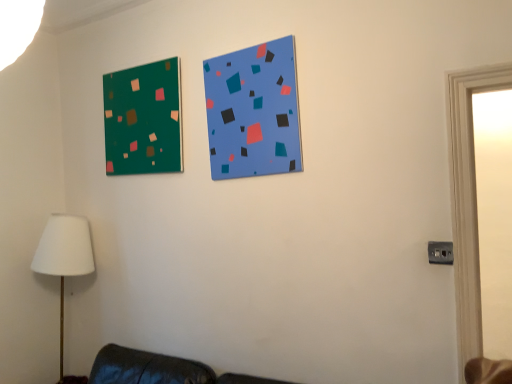
Question: Does green matte board at upper left, which is counted as the 2th bulletin board, starting from the right, have a larger size compared to white fabric lampshade at lower left?

Choices:
 (A) yes
 (B) no

Answer: (B)

Question: From a real-world perspective, is green matte board at upper left, the 1th bulletin board viewed from the back, physically above white fabric lampshade at lower left?

Choices:
 (A) yes
 (B) no

Answer: (A)

Question: From the image's perspective, is green matte board at upper left, which is counted as the 2th bulletin board, starting from the right, above white fabric lampshade at lower left?

Choices:
 (A) no
 (B) yes

Answer: (B)

Question: Are green matte board at upper left, which is the 1th bulletin board from left to right, and white fabric lampshade at lower left located far from each other?

Choices:
 (A) yes
 (B) no

Answer: (B)

Question: Can you confirm if green matte board at upper left, the second bulletin board viewed from the front, is smaller than white fabric lampshade at lower left?

Choices:
 (A) yes
 (B) no

Answer: (A)

Question: Is white fabric lampshade at lower left in front of or behind green matte board at upper left, the second bulletin board viewed from the front, in the image?

Choices:
 (A) behind
 (B) front

Answer: (A)

Question: Is white fabric lampshade at lower left inside the boundaries of green matte board at upper left, which is the 1th bulletin board from left to right, or outside?

Choices:
 (A) inside
 (B) outside

Answer: (B)

Question: From a real-world perspective, is white fabric lampshade at lower left above or below green matte board at upper left, the 1th bulletin board viewed from the back?

Choices:
 (A) below
 (B) above

Answer: (A)

Question: From the image's perspective, is white fabric lampshade at lower left above or below green matte board at upper left, the 1th bulletin board viewed from the back?

Choices:
 (A) below
 (B) above

Answer: (A)

Question: Looking at their shapes, would you say white fabric lampshade at lower left is wider or thinner than blue matte bulletin board at upper center, the first bulletin board in the right-to-left sequence?

Choices:
 (A) wide
 (B) thin

Answer: (A)

Question: Is white fabric lampshade at lower left inside or outside of blue matte bulletin board at upper center, the first bulletin board positioned from the front?

Choices:
 (A) inside
 (B) outside

Answer: (B)

Question: Looking at the image, does white fabric lampshade at lower left seem bigger or smaller compared to blue matte bulletin board at upper center, the 2th bulletin board in the left-to-right sequence?

Choices:
 (A) small
 (B) big

Answer: (B)

Question: From their relative heights in the image, would you say white fabric lampshade at lower left is taller or shorter than blue matte bulletin board at upper center, the first bulletin board in the right-to-left sequence?

Choices:
 (A) short
 (B) tall

Answer: (B)

Question: Is green matte board at upper left, the 1th bulletin board viewed from the back, inside or outside of white fabric lampshade at lower left?

Choices:
 (A) inside
 (B) outside

Answer: (B)

Question: Is point (146, 102) positioned closer to the camera than point (45, 251)?

Choices:
 (A) farther
 (B) closer

Answer: (B)